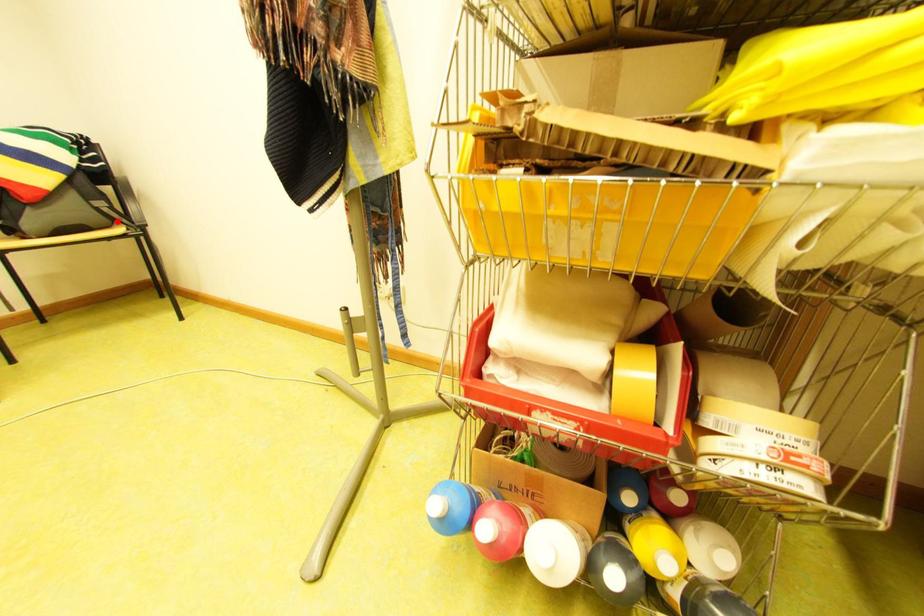
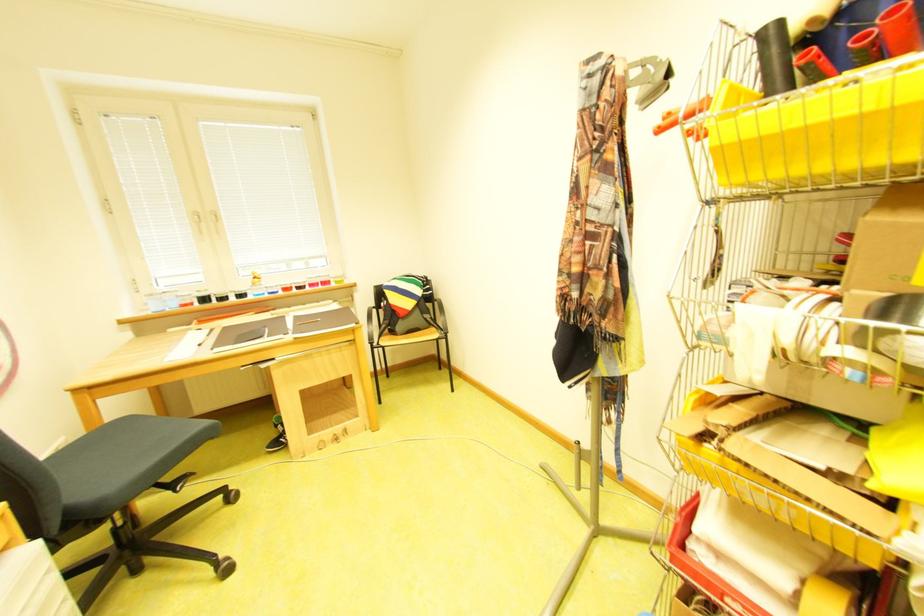
The point at the highlighted location is marked in the first image. Where is the corresponding point in the second image?

(439, 326)